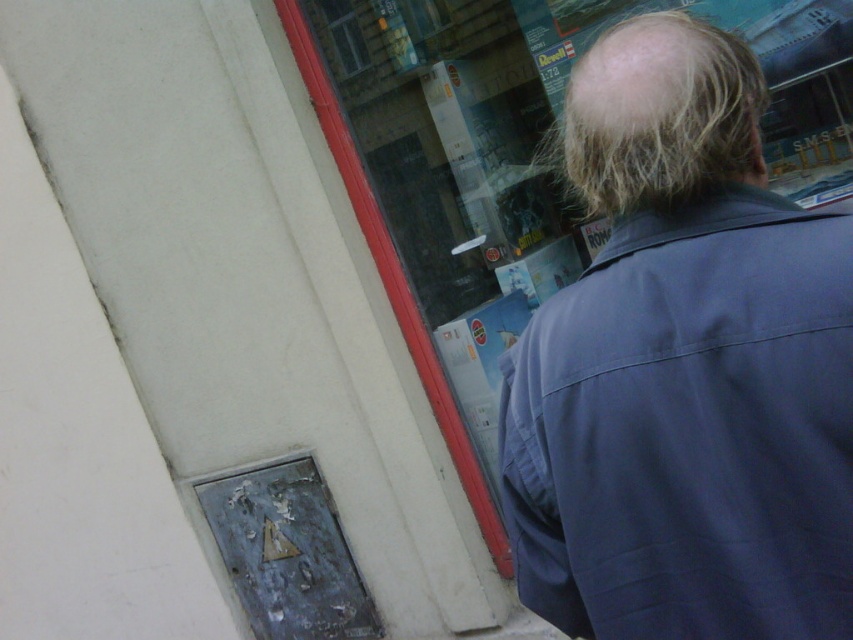
You are a delivery person trying to determine if the dark blue fabric at upper right and the blonde hair at upper right can both fit within a 10cm wide box. Based on their widths, will they fit?

The dark blue fabric at upper right is wider than the blonde hair at upper right. Since the box is only 10cm wide, and the dark blue fabric at upper right alone is wider than the box, both items cannot fit together in the box.

You are a passerby who wants to see the shop window clearly. The dark blue fabric at upper right and the blonde hair at upper right are blocking your view. Which object is closer to the camera and thus more obstructive?

The blonde hair at upper right is above the dark blue fabric at upper right, so it is closer to the camera and more obstructive.

You are a photographer trying to capture the reflection of the shop window. You notice the dark blue fabric at upper right and the blonde hair at upper right. Which object will appear larger in the reflection?

The dark blue fabric at upper right is bigger than the blonde hair at upper right, so it will appear larger in the reflection.